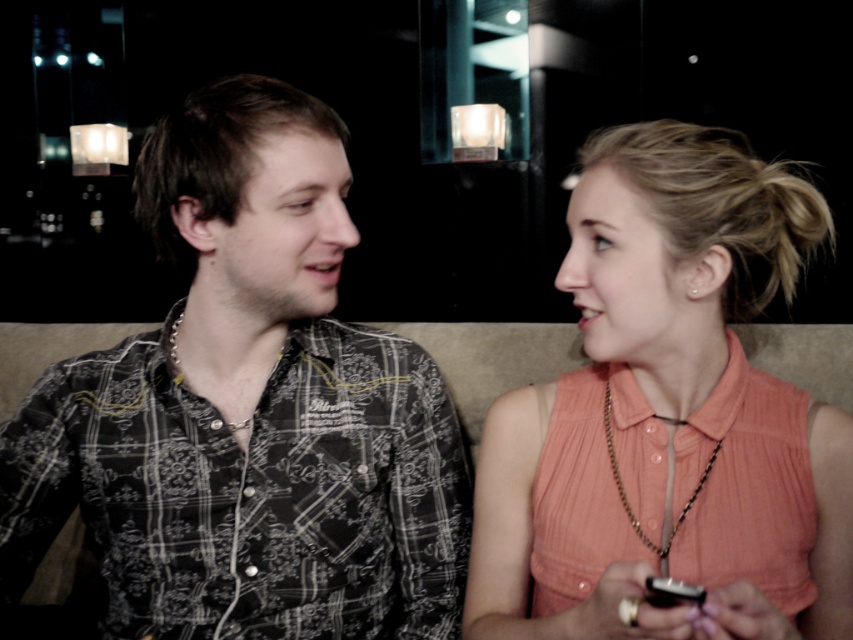
Between gold chain necklace at upper right and black plastic phone at lower right, which one has less height?

With less height is black plastic phone at lower right.

Measure the distance between gold chain necklace at upper right and camera.

gold chain necklace at upper right is 29.89 inches away from camera.

You are a GUI agent. You are given a task and a screenshot of the screen. Output one action in this format:
    pyautogui.click(x=<x>, y=<y>)
    Task: Click on the gold chain necklace at upper right
    The width and height of the screenshot is (853, 640).
    Given the screenshot: What is the action you would take?
    click(625, 493)

Is patterned fabric shirt at left thinner than gold chain necklace at upper right?

Incorrect, patterned fabric shirt at left's width is not less than gold chain necklace at upper right's.

Is point (347, 333) in front of point (631, 513)?

That is False.

Locate an element on the screen. patterned fabric shirt at left is located at coordinates (248, 410).

Is point (656, 397) positioned before point (654, 592)?

No.

Who is positioned more to the left, matte peach blouse at right or black plastic phone at lower right?

Positioned to the left is black plastic phone at lower right.

Does point (643, 148) come in front of point (666, 600)?

No, it is not.

Where is `matte peach blouse at right`? This screenshot has width=853, height=640. matte peach blouse at right is located at coordinates (668, 417).